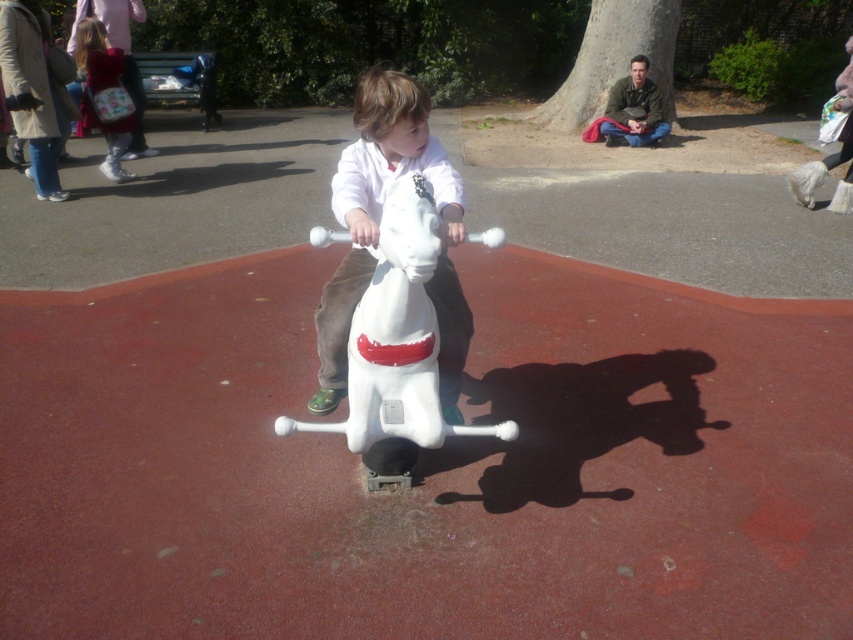
Question: Which point is farther to the camera?

Choices:
 (A) velvet red backpack at upper left
 (B) white matte horse at center

Answer: (A)

Question: Is white plastic horse at center to the right of velvet red backpack at upper left from the viewer's perspective?

Choices:
 (A) yes
 (B) no

Answer: (A)

Question: Can you confirm if white plastic horse at center is positioned to the left of white matte horse at center?

Choices:
 (A) no
 (B) yes

Answer: (A)

Question: Among these points, which one is farthest from the camera?

Choices:
 (A) (111, 150)
 (B) (404, 328)
 (C) (321, 353)

Answer: (A)

Question: Which point is farther to the camera?

Choices:
 (A) (374, 464)
 (B) (115, 65)
 (C) (373, 196)

Answer: (B)

Question: Can you confirm if white plastic horse at center is positioned below velvet red backpack at upper left?

Choices:
 (A) yes
 (B) no

Answer: (A)